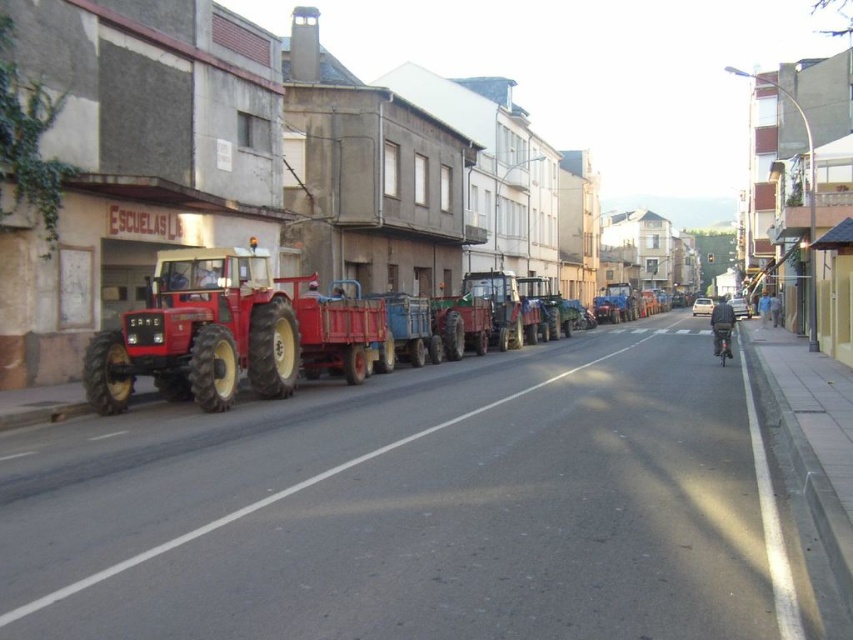
The image size is (853, 640). What are the coordinates of `matte red tractor at left` in the screenshot? It's located at (227, 332).

Does matte red tractor at left have a lesser height compared to metallic red tractor at center?

In fact, matte red tractor at left may be taller than metallic red tractor at center.

What do you see at coordinates (227, 332) in the screenshot? This screenshot has width=853, height=640. I see `matte red tractor at left` at bounding box center [227, 332].

Where is `matte red tractor at left`? The image size is (853, 640). matte red tractor at left is located at coordinates (227, 332).

Does metallic red tractor at center appear under shiny black motorcycle at center-right?

Correct, metallic red tractor at center is located below shiny black motorcycle at center-right.

Is metallic red tractor at center shorter than shiny black motorcycle at center-right?

In fact, metallic red tractor at center may be taller than shiny black motorcycle at center-right.

Which is in front, point (277, 496) or point (714, 342)?

Positioned in front is point (277, 496).

This screenshot has width=853, height=640. What are the coordinates of `metallic red tractor at center` in the screenshot? It's located at (287, 493).

Is matte red tractor at left closer to camera compared to shiny black motorcycle at center-right?

Yes, matte red tractor at left is in front of shiny black motorcycle at center-right.

Between matte red tractor at left and shiny black motorcycle at center-right, which one appears on the left side from the viewer's perspective?

Positioned to the left is matte red tractor at left.

Which is in front, point (306, 314) or point (715, 330)?

Point (306, 314)

I want to click on matte red tractor at left, so click(227, 332).